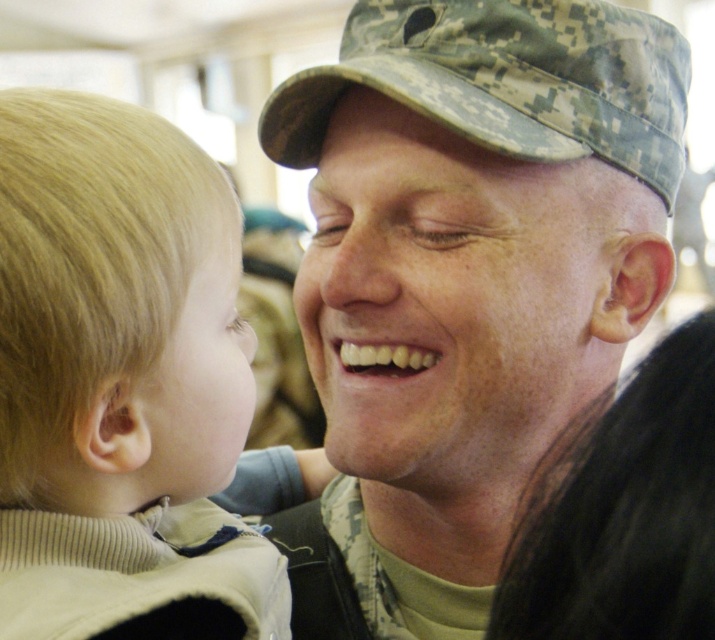
Where is the camouflage uniform at center located in the image?

The camouflage uniform at center is located at point (470, 268).

Where is the blonde hair at left positioned in the image?

The blonde hair at left is positioned at point coordinates of 0.598 on the x axis and 0.171 on the y axis.